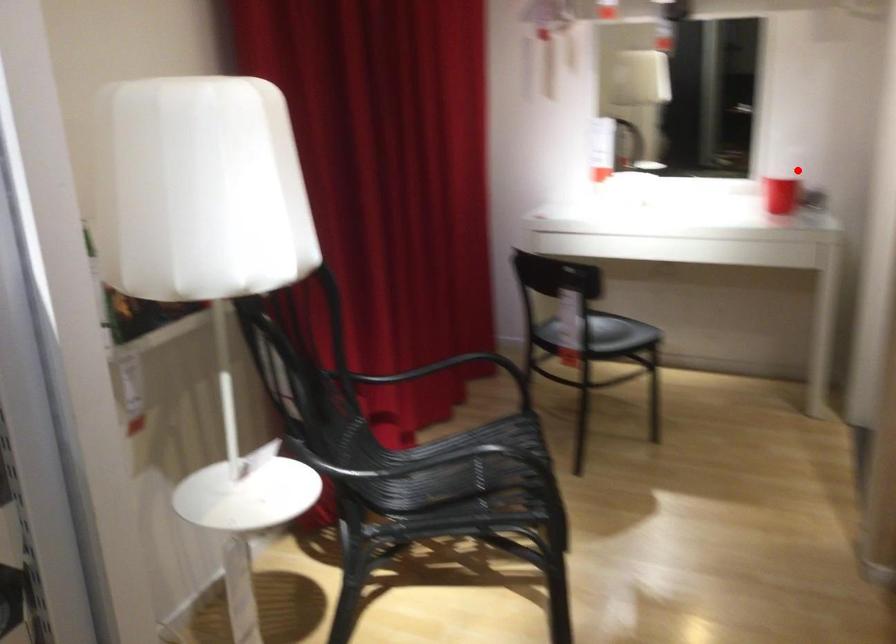
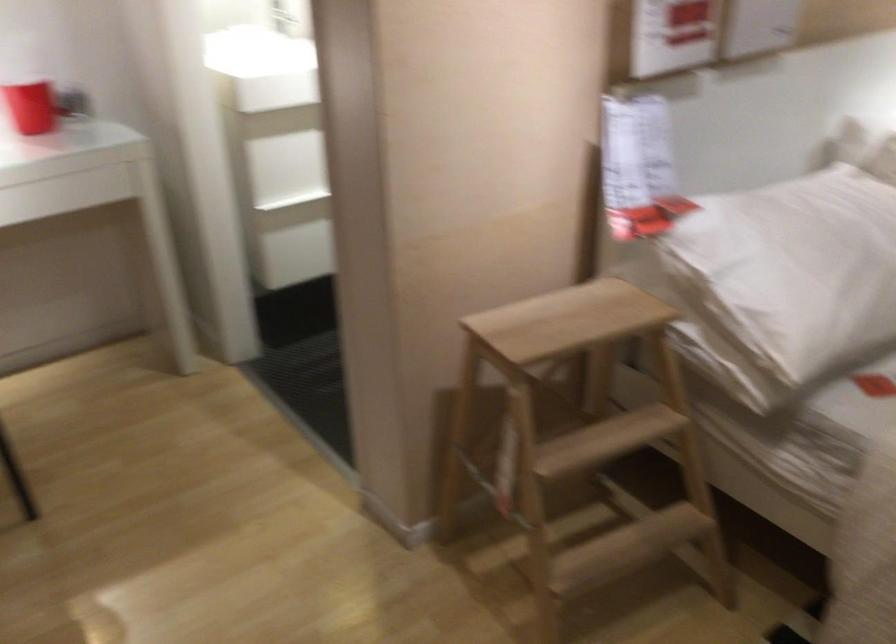
In the second image, find the point that corresponds to the highlighted location in the first image.

(30, 105)